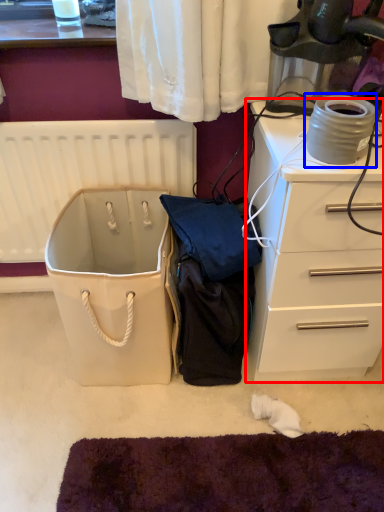
Question: Among these objects, which one is farthest to the camera, chest of drawers (highlighted by a red box) or appliance (highlighted by a blue box)?

Choices:
 (A) chest of drawers
 (B) appliance

Answer: (A)